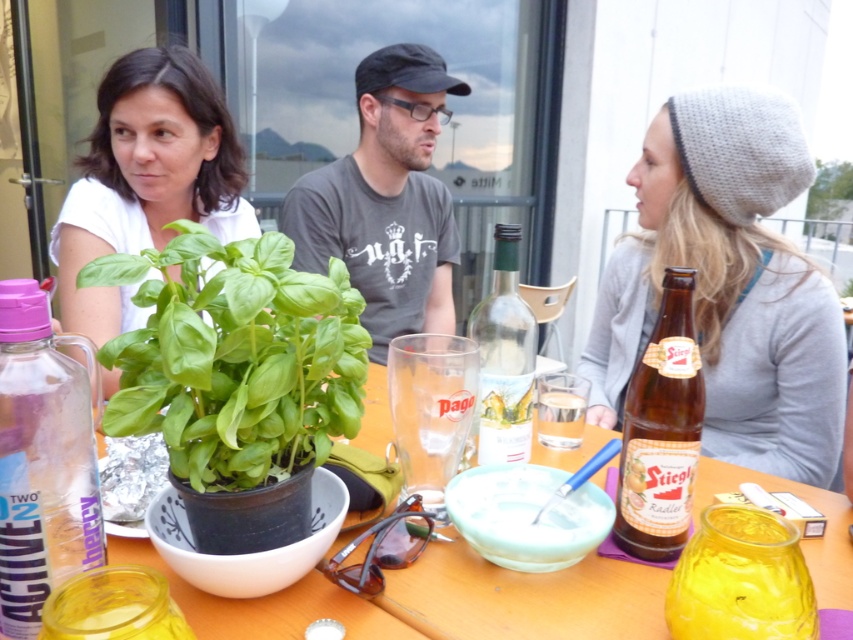
You are a guest at the gathering and want to place a small keychain on the table. Which object, the clear glass bottle at center or the translucent plastic jar at lower left, would allow you to place the keychain next to it without blocking the view of the other items on the table?

The clear glass bottle at center has a lesser width compared to the translucent plastic jar at lower left, so placing the keychain next to the clear glass bottle at center would leave more space and avoid blocking the view of other items.

You are at a party and want to pour a drink into the brown glass bottle at right or the clear glass at center. Which one can hold more liquid based on their widths?

The brown glass bottle at right might be wider than clear glass at center, so it could potentially hold more liquid if its volume is greater.

You are a guest at the gathering and want to place a small plate between the wooden table at center and the translucent glass jar at center. Based on their positions, where should you place the plate?

The wooden table at center is positioned on the left side of the translucent glass jar at center, so you should place the plate to the left of the translucent glass jar at center or to the right of the wooden table at center to place it between them.